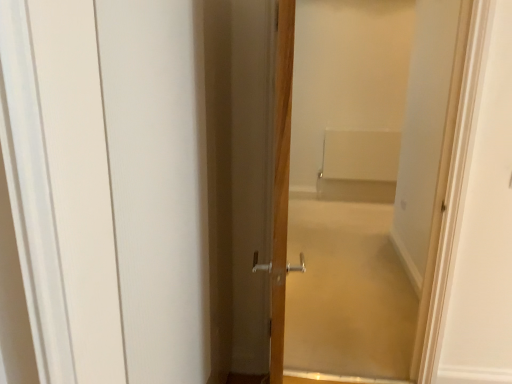
Image resolution: width=512 pixels, height=384 pixels. I want to click on wooden door at center, placed as the 1th door when sorted from right to left, so tap(342, 207).

What is the approximate width of wooden door at center, marked as the 1th door in a left-to-right arrangement?

wooden door at center, marked as the 1th door in a left-to-right arrangement, is 3.41 inches in width.

What do you see at coordinates (125, 181) in the screenshot? I see `white matte barn door at left` at bounding box center [125, 181].

What do you see at coordinates (359, 166) in the screenshot?
I see `white matte bath at center` at bounding box center [359, 166].

Locate an element on the screen. wooden door at center, placed as the 1th door when sorted from right to left is located at coordinates (342, 207).

Considering the positions of objects white matte barn door at left and wooden door at center, which is counted as the second door, starting from the left, in the image provided, who is behind, white matte barn door at left or wooden door at center, which is counted as the second door, starting from the left,?

Positioned behind is wooden door at center, which is counted as the second door, starting from the left.

Is white matte barn door at left at the right side of wooden door at center, placed as the 1th door when sorted from right to left?

In fact, white matte barn door at left is to the left of wooden door at center, placed as the 1th door when sorted from right to left.

Is white matte barn door at left inside or outside of wooden door at center, which is counted as the second door, starting from the left?

white matte barn door at left is located beyond the bounds of wooden door at center, which is counted as the second door, starting from the left.

Based on their sizes in the image, would you say white matte barn door at left is bigger or smaller than wooden door at center, placed as the 1th door when sorted from right to left?

Considering their sizes, white matte barn door at left takes up less space than wooden door at center, placed as the 1th door when sorted from right to left.

Looking at the image, does wooden door at center, which is counted as the second door, starting from the left, seem bigger or smaller compared to white matte bath at center?

Considering their sizes, wooden door at center, which is counted as the second door, starting from the left, takes up more space than white matte bath at center.

Considering the positions of objects wooden door at center, placed as the 1th door when sorted from right to left, and white matte bath at center in the image provided, who is more to the right, wooden door at center, placed as the 1th door when sorted from right to left, or white matte bath at center?

white matte bath at center is more to the right.

Locate an element on the screen. bath located above the wooden door at center, placed as the 1th door when sorted from right to left (from the image's perspective) is located at coordinates [359, 166].

From a real-world perspective, is white matte barn door at left physically below white matte bath at center?

No, from a real-world perspective, white matte barn door at left is not below white matte bath at center.

Between point (117, 352) and point (357, 177), which one is positioned behind?

Point (357, 177)

Would you say white matte barn door at left is inside or outside white matte bath at center?

white matte barn door at left exists outside the volume of white matte bath at center.

Is wooden door at center, marked as the 1th door in a left-to-right arrangement, in contact with wooden door at center, placed as the 1th door when sorted from right to left?

No, wooden door at center, marked as the 1th door in a left-to-right arrangement, is not touching wooden door at center, placed as the 1th door when sorted from right to left.

Can you confirm if wooden door at center, positioned as the 2th door in right-to-left order, is smaller than wooden door at center, which is counted as the second door, starting from the left?

Yes.

Which is correct: wooden door at center, positioned as the 2th door in right-to-left order, is inside wooden door at center, placed as the 1th door when sorted from right to left, or outside of it?

The correct answer is: outside.

Identify the location of bath located on the right of wooden door at center, positioned as the 2th door in right-to-left order. This screenshot has width=512, height=384. (359, 166).

Is the depth of white matte bath at center less than that of wooden door at center, marked as the 1th door in a left-to-right arrangement?

No, white matte bath at center is further to the viewer.

Can you confirm if white matte bath at center is shorter than wooden door at center, positioned as the 2th door in right-to-left order?

Yes.

From the image's perspective, which door is the 1st one below the white matte bath at center? Please provide its 2D coordinates.

[(342, 207)]

Can you confirm if white matte bath at center is bigger than wooden door at center, which is counted as the second door, starting from the left?

No.

Consider the image. Which object is positioned more to the left, white matte bath at center or wooden door at center, placed as the 1th door when sorted from right to left?

From the viewer's perspective, wooden door at center, placed as the 1th door when sorted from right to left, appears more on the left side.

Does point (284, 1) come farther from viewer compared to point (354, 168)?

No, (284, 1) is in front of (354, 168).

From a real-world perspective, which object stands above the other?

From a 3D spatial view, wooden door at center, marked as the 1th door in a left-to-right arrangement, is above.

Which object is further away from the camera taking this photo, wooden door at center, marked as the 1th door in a left-to-right arrangement, or white matte bath at center?

white matte bath at center is more distant.

At what (x,y) coordinates should I click in order to perform the action: click on bath above the wooden door at center, positioned as the 2th door in right-to-left order (from the image's perspective). Please return your answer as a coordinate pair (x, y). Looking at the image, I should click on (359, 166).

What are the coordinates of `the 2nd door positioned above the white matte barn door at left (from the image's perspective)` in the screenshot? It's located at (342, 207).

Identify the location of bath on the right of wooden door at center, which is counted as the second door, starting from the left. The image size is (512, 384). (359, 166).

In the scene shown: When comparing their distances from wooden door at center, marked as the 1th door in a left-to-right arrangement, does wooden door at center, placed as the 1th door when sorted from right to left, or white matte barn door at left seem closer?

Based on the image, white matte barn door at left appears to be nearer to wooden door at center, marked as the 1th door in a left-to-right arrangement.

Looking at the image, which one is located closer to white matte bath at center, white matte barn door at left or wooden door at center, which is counted as the second door, starting from the left?

Among the two, wooden door at center, which is counted as the second door, starting from the left, is located nearer to white matte bath at center.

Based on their spatial positions, is wooden door at center, positioned as the 2th door in right-to-left order, or white matte bath at center closer to white matte barn door at left?

Among the two, wooden door at center, positioned as the 2th door in right-to-left order, is located nearer to white matte barn door at left.

Estimate the real-world distances between objects in this image. Which object is further from white matte barn door at left, white matte bath at center or wooden door at center, placed as the 1th door when sorted from right to left?

Based on the image, white matte bath at center appears to be further to white matte barn door at left.

Based on their spatial positions, is white matte bath at center or wooden door at center, placed as the 1th door when sorted from right to left, closer to wooden door at center, positioned as the 2th door in right-to-left order?

Based on the image, wooden door at center, placed as the 1th door when sorted from right to left, appears to be nearer to wooden door at center, positioned as the 2th door in right-to-left order.

Estimate the real-world distances between objects in this image. Which object is closer to white matte bath at center, wooden door at center, which is counted as the second door, starting from the left, or white matte barn door at left?

The object closer to white matte bath at center is wooden door at center, which is counted as the second door, starting from the left.

Estimate the real-world distances between objects in this image. Which object is further from wooden door at center, placed as the 1th door when sorted from right to left, white matte barn door at left or white matte bath at center?

white matte bath at center.

Which object lies further to the anchor point wooden door at center, positioned as the 2th door in right-to-left order, white matte bath at center or white matte barn door at left?

white matte bath at center lies further to wooden door at center, positioned as the 2th door in right-to-left order, than the other object.

Identify the location of door between white matte barn door at left and wooden door at center, placed as the 1th door when sorted from right to left, in the front-back direction. (260, 182).

Locate an element on the screen. The height and width of the screenshot is (384, 512). door between wooden door at center, marked as the 1th door in a left-to-right arrangement, and white matte bath at center in the front-back direction is located at coordinates (342, 207).